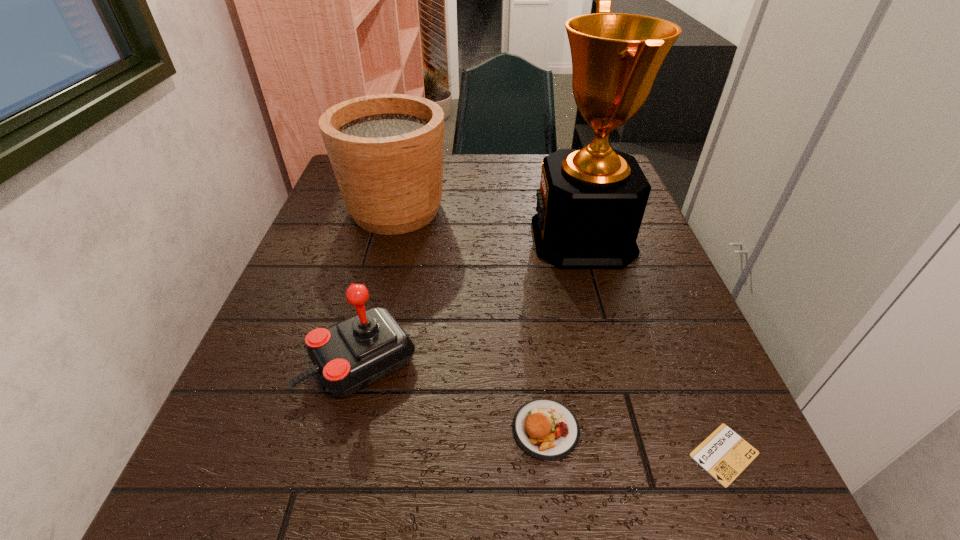
What are the coordinates of `vacant space at the far edge` in the screenshot? It's located at (491, 185).

You are a GUI agent. You are given a task and a screenshot of the screen. Output one action in this format:
    pyautogui.click(x=<x>, y=<y>)
    Task: Click on the free space at the near edge
    
    Given the screenshot: What is the action you would take?
    point(562,488)

In the image, there is a desktop. Where is `free space at the left edge`? Image resolution: width=960 pixels, height=540 pixels. free space at the left edge is located at coordinates (250, 409).

Image resolution: width=960 pixels, height=540 pixels. In the image, there is a desktop. Identify the location of vacant space at the right edge. (655, 376).

Identify the location of vacant space that's between the fourth shortest object and the patty (food). (470, 319).

Find the location of a particular element. blank region between the fourth shortest object and the tallest object is located at coordinates (490, 224).

Where is `vacant region between the fourth shortest object and the identity card`? This screenshot has height=540, width=960. vacant region between the fourth shortest object and the identity card is located at coordinates (560, 332).

The width and height of the screenshot is (960, 540). What are the coordinates of `free spot between the second shortest object and the tallest object` in the screenshot? It's located at (564, 334).

The width and height of the screenshot is (960, 540). Find the location of `vacant space that's between the identity card and the fourth tallest object`. vacant space that's between the identity card and the fourth tallest object is located at coordinates (635, 442).

Find the location of `free spot between the second tallest object and the shortest object`. free spot between the second tallest object and the shortest object is located at coordinates (560, 332).